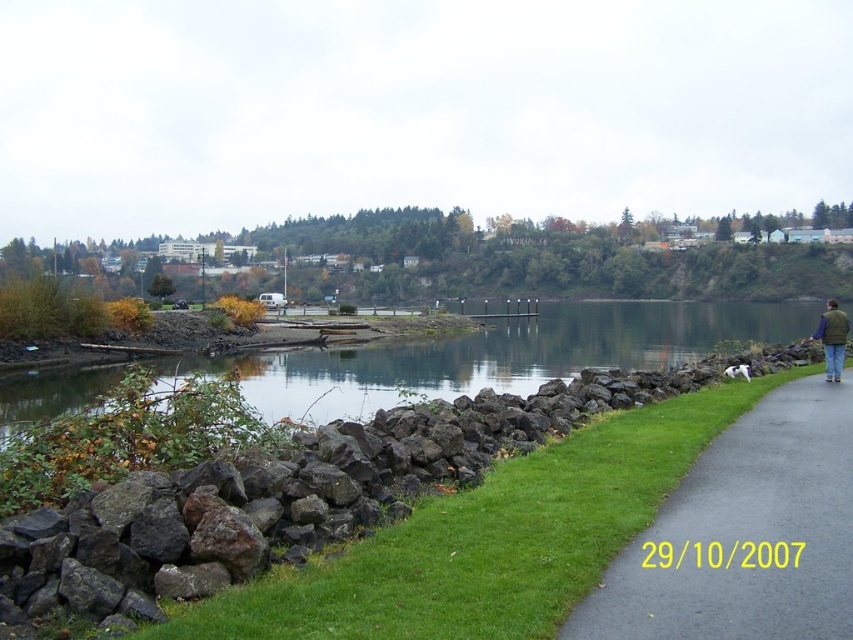
Based on the coordinates provided, which object in the scene is located at point [486,540]?

The green grass at lower left is located at point [486,540].

Looking at this image, you are standing at the edge of the clear water at center and want to walk back to the black asphalt pavement at lower right. Is the path to the pavement going uphill or downhill?

The black asphalt pavement at lower right is closer to the viewer than the clear water at center, which suggests that the path to the pavement is going downhill since you would be moving towards a closer area which is typically lower in elevation.